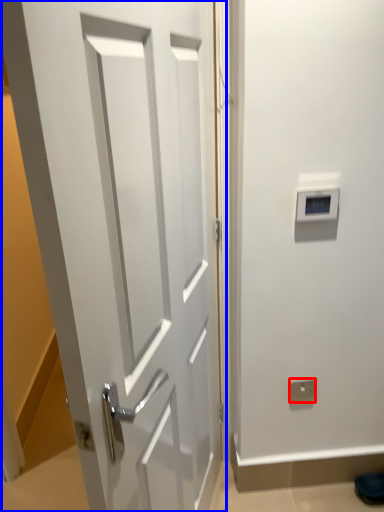
Question: Which of the following is the farthest to the observer, electric outlet (highlighted by a red box) or door (highlighted by a blue box)?

Choices:
 (A) electric outlet
 (B) door

Answer: (A)